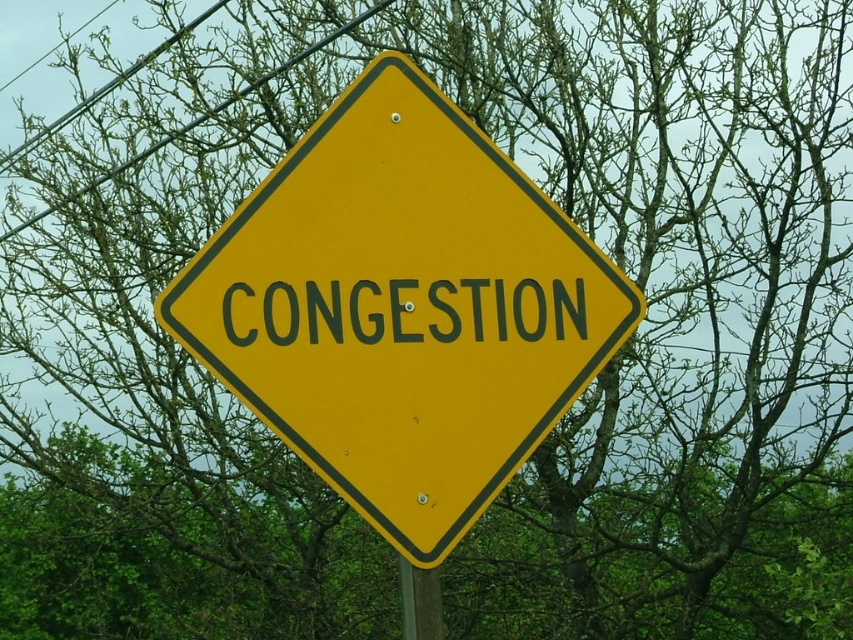
Consider the image. You are a painter who needs to paint the metallic wire at upper left and the green wood pole at lower center. Which object requires a taller ladder to reach?

The metallic wire at upper left requires a taller ladder to reach because it has a greater height compared to the green wood pole at lower center.